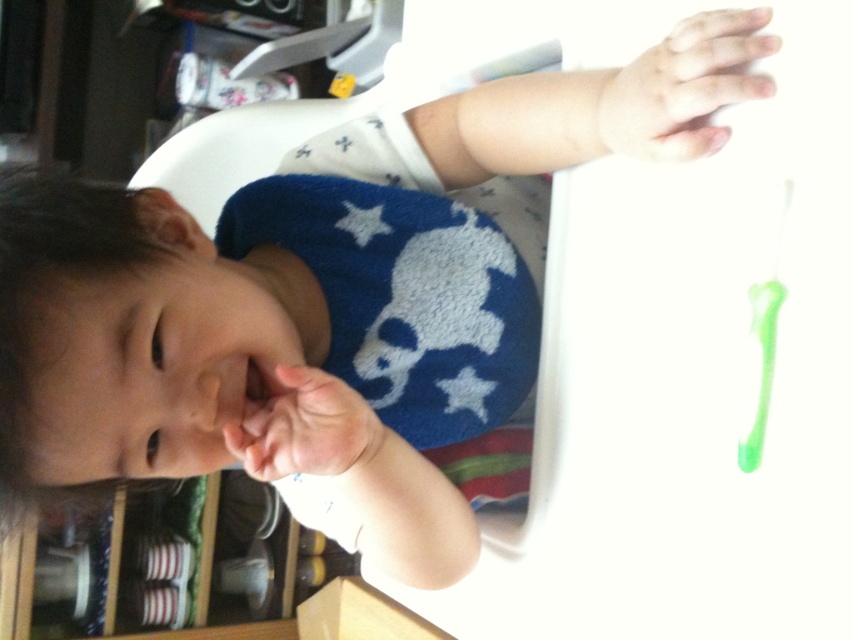
Does smooth skin hand at upper right come in front of pink soft skin at center?

Yes, it is in front of pink soft skin at center.

At what (x,y) coordinates should I click in order to perform the action: click on smooth skin hand at upper right. Please return your answer as a coordinate pair (x, y). Looking at the image, I should click on (685, 86).

Locate an element on the screen. The width and height of the screenshot is (853, 640). smooth skin hand at upper right is located at coordinates 685,86.